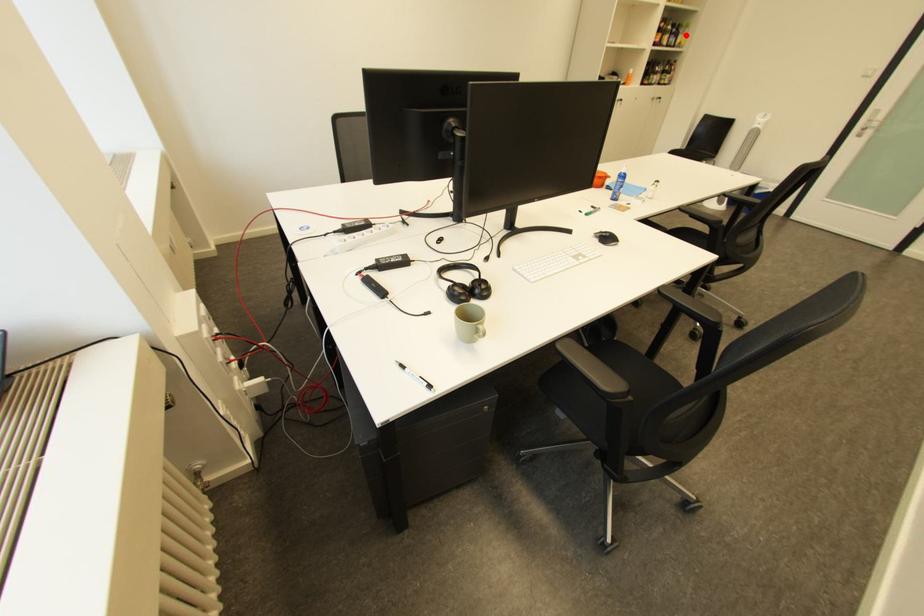
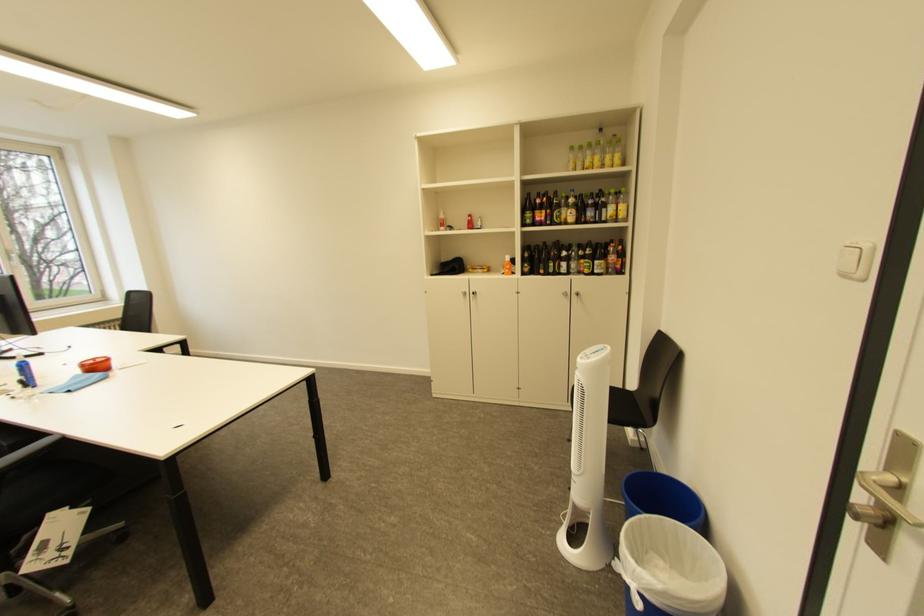
Locate, in the second image, the point that corresponds to the highlighted location in the first image.

(610, 208)